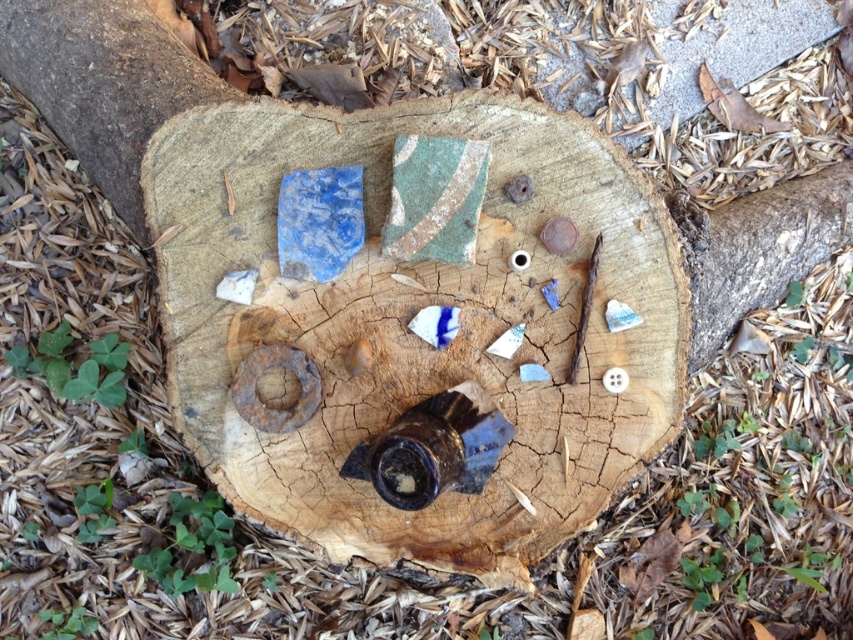
You are an archaeologist examining the tree stump. You notice the blue ceramic tile at center and the brown rough wood at upper left. Which object is closer to you when you look at the stump?

The blue ceramic tile at center is closer to you because it is in front of the brown rough wood at upper left.

You are an artist looking to arrange objects on a tree stump. You have a blue ceramic tile at center and a brown rough wood at upper left. Based on their positions, which object is closer to the ground?

The blue ceramic tile at center is closer to the ground because it is positioned below the brown rough wood at upper left.